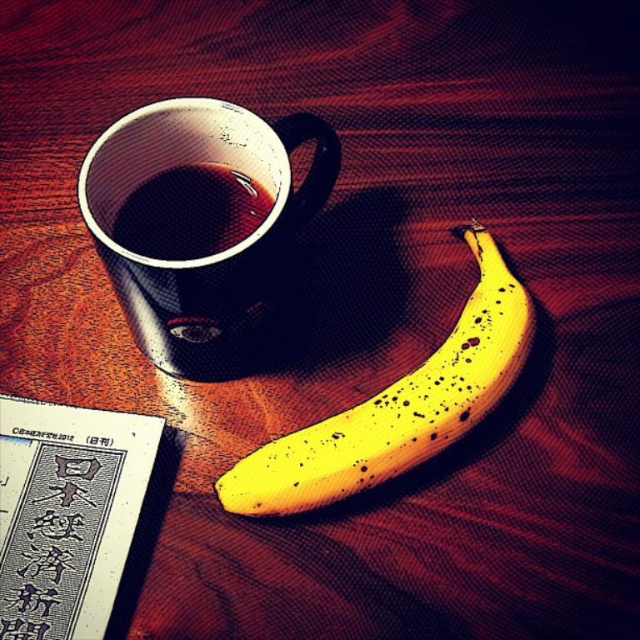
Question: Does yellow matte banana at center have a greater width compared to shiny black cup at upper left?

Choices:
 (A) no
 (B) yes

Answer: (B)

Question: Which of these objects is positioned farthest from the matte black mug at upper left?

Choices:
 (A) yellow matte banana at center
 (B) shiny black cup at upper left

Answer: (A)

Question: Does yellow matte banana at center have a lesser width compared to shiny black cup at upper left?

Choices:
 (A) no
 (B) yes

Answer: (A)

Question: Is the position of matte black mug at upper left more distant than that of shiny black cup at upper left?

Choices:
 (A) no
 (B) yes

Answer: (A)

Question: Which of the following is the closest to the observer?

Choices:
 (A) (385, 394)
 (B) (240, 204)

Answer: (A)

Question: Among these points, which one is nearest to the camera?

Choices:
 (A) (81, 200)
 (B) (348, 424)

Answer: (A)